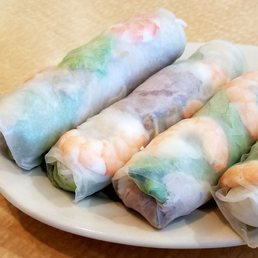
This screenshot has height=258, width=258. Find the location of `the bottom edge of plate`. the bottom edge of plate is located at coordinates (57, 224).